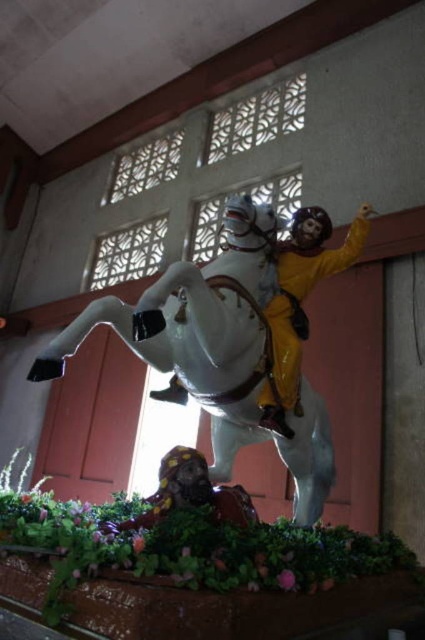
From the picture: Who is more distant from viewer, (234, 234) or (198, 476)?

Point (234, 234)

Is glossy white horse at center to the left of smooth yellow helmet at lower center from the viewer's perspective?

No, glossy white horse at center is not to the left of smooth yellow helmet at lower center.

Describe the element at coordinates (218, 349) in the screenshot. Image resolution: width=425 pixels, height=640 pixels. I see `glossy white horse at center` at that location.

In order to click on glossy white horse at center in this screenshot , I will do `click(218, 349)`.

Who is shorter, glossy white horse at center or yellow matte figure at upper center?

With less height is yellow matte figure at upper center.

Is glossy white horse at center above yellow matte figure at upper center?

No, glossy white horse at center is not above yellow matte figure at upper center.

Between point (156, 356) and point (274, 346), which one is positioned behind?

Positioned behind is point (274, 346).

Where is `glossy white horse at center`? The width and height of the screenshot is (425, 640). glossy white horse at center is located at coordinates (218, 349).

Who is more distant from viewer, (299,288) or (170,497)?

Point (299,288)

Between yellow matte figure at upper center and smooth yellow helmet at lower center, which one appears on the right side from the viewer's perspective?

Positioned to the right is yellow matte figure at upper center.

Find the location of a particular element. This screenshot has height=640, width=425. yellow matte figure at upper center is located at coordinates (300, 304).